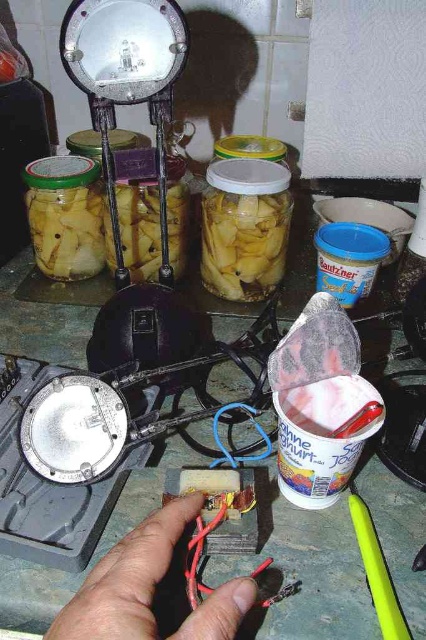
Question: Observing the image, what is the correct spatial positioning of skinny flesh-toned hand at lower center in reference to yellowish translucent jar at center?

Choices:
 (A) below
 (B) above

Answer: (A)

Question: Which object is farther from the camera taking this photo?

Choices:
 (A) yellowish translucent jar at center
 (B) skinny flesh-toned hand at lower center

Answer: (A)

Question: Can you confirm if skinny flesh-toned hand at lower center is thinner than yellowish translucent jar at center?

Choices:
 (A) no
 (B) yes

Answer: (A)

Question: Is skinny flesh-toned hand at lower center bigger than yellowish translucent jar at center?

Choices:
 (A) no
 (B) yes

Answer: (A)